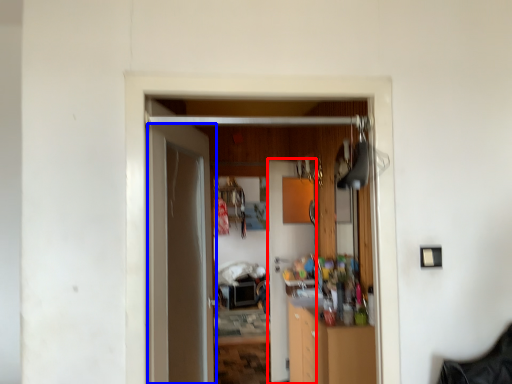
Question: Among these objects, which one is nearest to the camera, door (highlighted by a red box) or door (highlighted by a blue box)?

Choices:
 (A) door
 (B) door

Answer: (B)